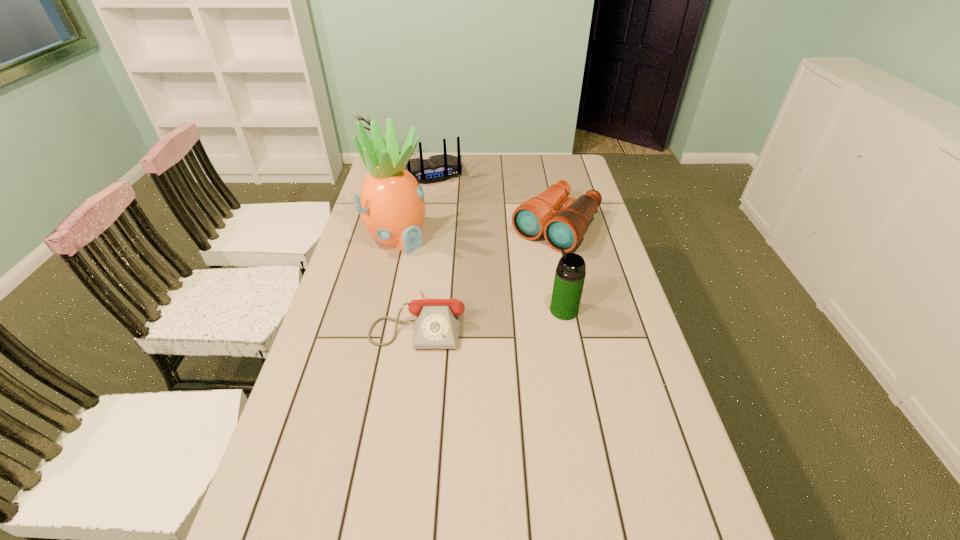
The width and height of the screenshot is (960, 540). Identify the location of the shortest object. pos(437,323).

Where is `thermos bottle`? The width and height of the screenshot is (960, 540). thermos bottle is located at coordinates (570, 273).

Identify the location of pineapple. (391, 203).

At what (x,y) coordinates should I click in order to perform the action: click on the fourth tallest object. Please return your answer as a coordinate pair (x, y). Looking at the image, I should click on (564, 229).

Find the location of a particular element. the farthest object is located at coordinates (437, 168).

The width and height of the screenshot is (960, 540). Find the location of `the third tallest object`. the third tallest object is located at coordinates (437, 168).

Find the location of a particular element. Image resolution: width=960 pixels, height=540 pixels. vacant area located 0.350m on the dial of the telephone is located at coordinates (396, 485).

Locate an element on the screen. free spot located from the spout of the thermos bottle is located at coordinates (433, 310).

Identify the location of free spot located from the spout of the thermos bottle. This screenshot has width=960, height=540. (422, 310).

Locate an element on the screen. Image resolution: width=960 pixels, height=540 pixels. free region located 0.200m from the spout of the thermos bottle is located at coordinates (481, 310).